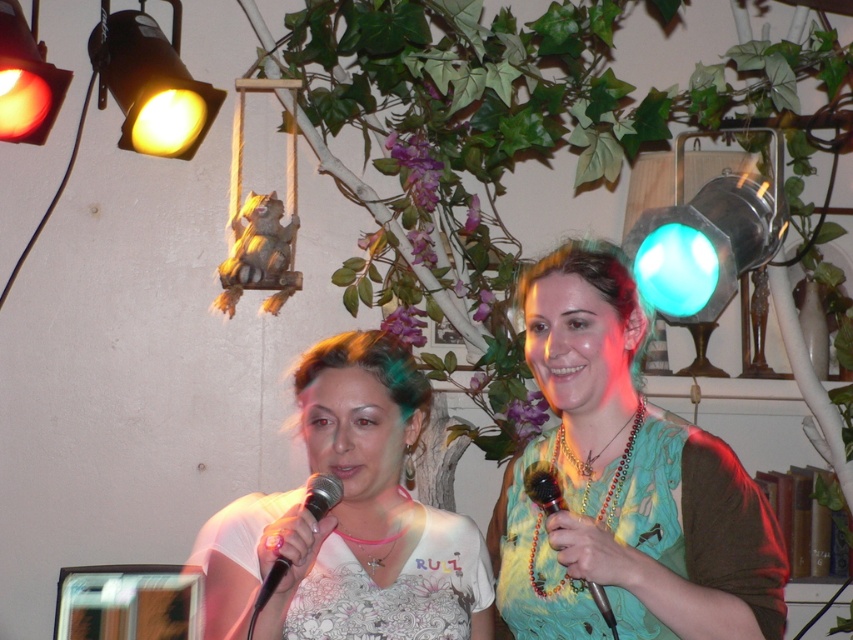
Question: Does white printed shirt at center have a smaller size compared to shiny green dress at right?

Choices:
 (A) yes
 (B) no

Answer: (B)

Question: Which of the following is the farthest from the observer?

Choices:
 (A) blue glass spotlight at upper right
 (B) white printed shirt at center
 (C) multicolored beaded necklace at upper right
 (D) matte yellow spotlight at upper left

Answer: (D)

Question: Does shiny green dress at right have a lesser width compared to blue glass spotlight at upper right?

Choices:
 (A) yes
 (B) no

Answer: (A)

Question: Does matte orange spotlight at upper left have a greater width compared to wooden beaded microphone at center?

Choices:
 (A) yes
 (B) no

Answer: (A)

Question: Which object is closer to the camera taking this photo?

Choices:
 (A) white floral fabric dress at center
 (B) matte orange spotlight at upper left

Answer: (A)

Question: Among these objects, which one is nearest to the camera?

Choices:
 (A) blue glass spotlight at upper right
 (B) white printed shirt at center
 (C) white floral fabric dress at center
 (D) matte orange spotlight at upper left

Answer: (B)